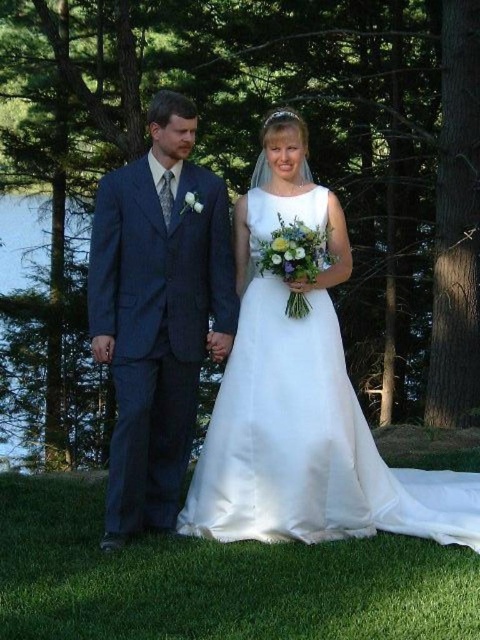
Between white satin dress at center and dark blue suit at left, which one is positioned lower?

Positioned lower is white satin dress at center.

Does white satin dress at center appear over dark blue suit at left?

Actually, white satin dress at center is below dark blue suit at left.

Is point (304, 397) positioned behind point (182, 420)?

No, (304, 397) is in front of (182, 420).

Image resolution: width=480 pixels, height=640 pixels. I want to click on white satin dress at center, so click(x=308, y=444).